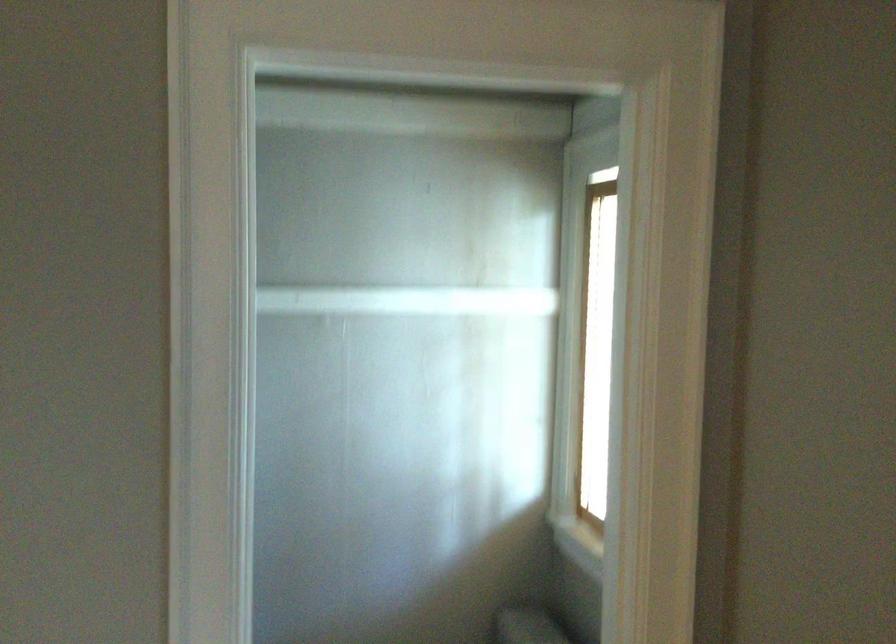
The image size is (896, 644). Describe the element at coordinates (407, 301) in the screenshot. I see `the white closet rod` at that location.